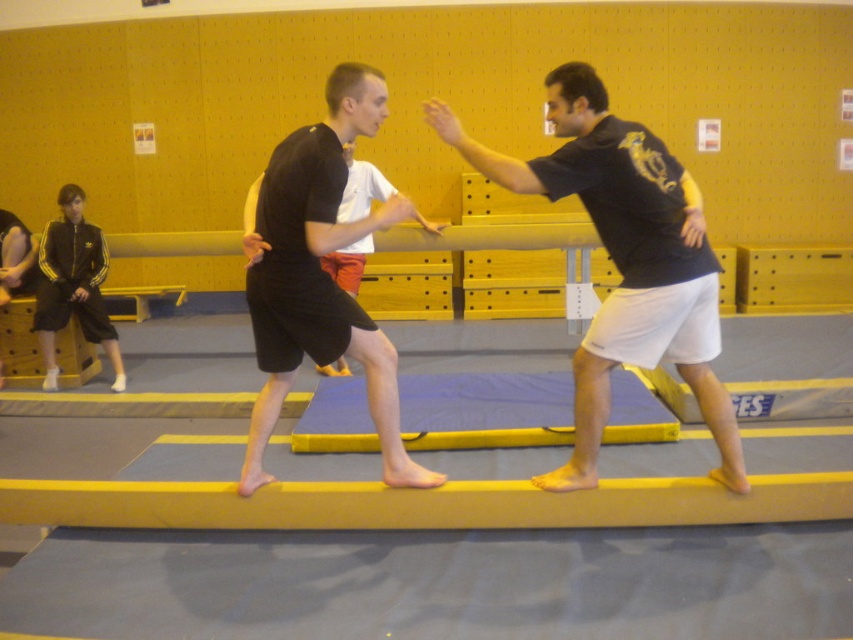
Who is more distant from viewer, (340, 502) or (289, 150)?

The point (340, 502) is more distant.

Does point (372, 492) lie behind point (396, 477)?

Yes, it is behind point (396, 477).

Locate an element on the screen. The image size is (853, 640). yellow foam beam at center is located at coordinates (422, 502).

Is black matte shorts at center taller than blue foam mat at center?

Correct, black matte shorts at center is much taller as blue foam mat at center.

Does black matte shorts at center appear under blue foam mat at center?

Incorrect, black matte shorts at center is not positioned below blue foam mat at center.

Describe the element at coordinates (318, 273) in the screenshot. Image resolution: width=853 pixels, height=640 pixels. I see `black matte shorts at center` at that location.

Locate an element on the screen. This screenshot has width=853, height=640. black matte shorts at center is located at coordinates (318, 273).

Is yellow foam beam at center in front of blue foam mat at center?

Yes, it is.

Can you confirm if yellow foam beam at center is positioned to the right of blue foam mat at center?

In fact, yellow foam beam at center is to the left of blue foam mat at center.

Locate an element on the screen. This screenshot has height=640, width=853. yellow foam beam at center is located at coordinates (422, 502).